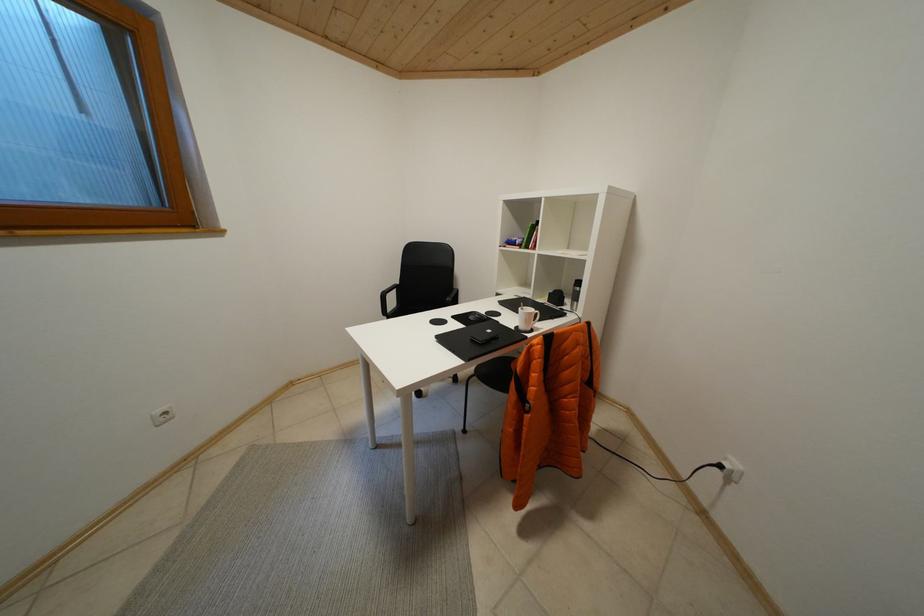
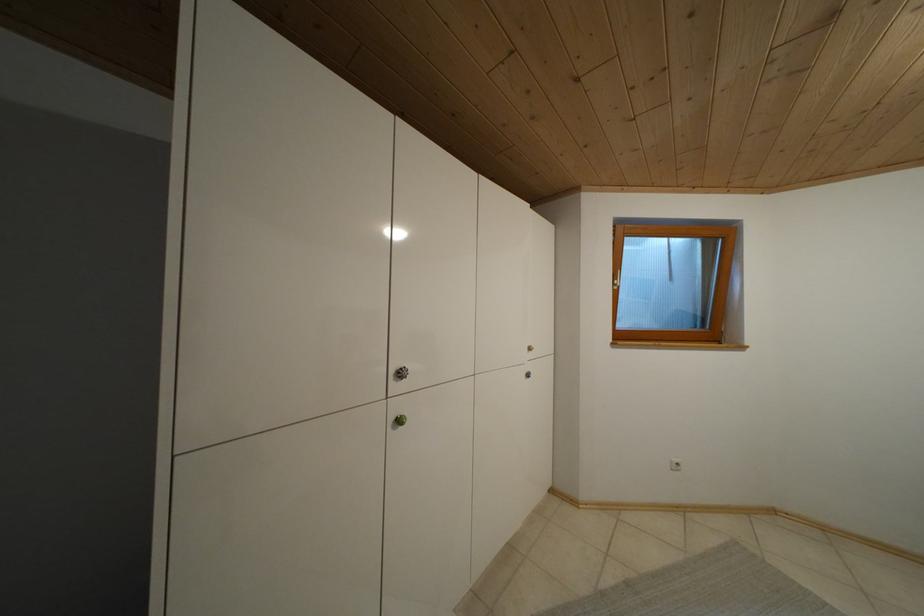
Question: The camera is either moving clockwise (left) or counter-clockwise (right) around the object. The first image is from the beginning of the video and the second image is from the end. Is the camera moving left or right when shooting the video?

Choices:
 (A) Left
 (B) Right

Answer: (B)